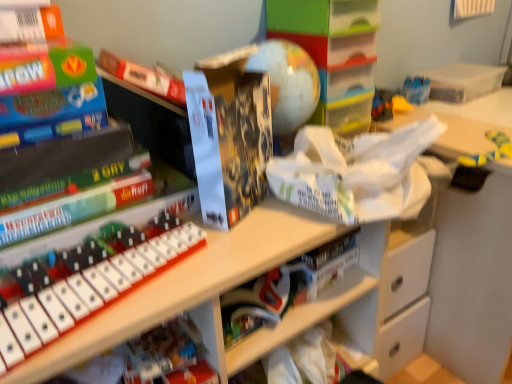
Question: Can you confirm if matte plastic globe at center, positioned as the second shelf in bottom-to-top order, is taller than matte black lego box at center?

Choices:
 (A) yes
 (B) no

Answer: (A)

Question: Would you say matte plastic globe at center, placed as the first shelf when sorted from top to bottom, is outside matte black lego box at center?

Choices:
 (A) yes
 (B) no

Answer: (A)

Question: Can you confirm if matte plastic globe at center, positioned as the second shelf in bottom-to-top order, is positioned to the left of matte black lego box at center?

Choices:
 (A) yes
 (B) no

Answer: (B)

Question: From a real-world perspective, is matte plastic globe at center, placed as the first shelf when sorted from top to bottom, positioned under matte black lego box at center based on gravity?

Choices:
 (A) no
 (B) yes

Answer: (A)

Question: From the image's perspective, is matte plastic globe at center, placed as the first shelf when sorted from top to bottom, above matte black lego box at center?

Choices:
 (A) no
 (B) yes

Answer: (B)

Question: Can you confirm if matte plastic globe at center, placed as the first shelf when sorted from top to bottom, is positioned to the right of matte black lego box at center?

Choices:
 (A) yes
 (B) no

Answer: (A)

Question: Considering the relative sizes of clear plastic box at upper right and matte plastic globe at center, positioned as the second shelf in bottom-to-top order, in the image provided, is clear plastic box at upper right taller than matte plastic globe at center, positioned as the second shelf in bottom-to-top order,?

Choices:
 (A) no
 (B) yes

Answer: (A)

Question: Does clear plastic box at upper right contain matte plastic globe at center, positioned as the second shelf in bottom-to-top order?

Choices:
 (A) yes
 (B) no

Answer: (B)

Question: Would you say clear plastic box at upper right is a long distance from matte plastic globe at center, positioned as the second shelf in bottom-to-top order?

Choices:
 (A) yes
 (B) no

Answer: (B)

Question: Can you confirm if clear plastic box at upper right is positioned to the right of matte plastic globe at center, placed as the first shelf when sorted from top to bottom?

Choices:
 (A) no
 (B) yes

Answer: (B)

Question: From a real-world perspective, is clear plastic box at upper right below matte plastic globe at center, positioned as the second shelf in bottom-to-top order?

Choices:
 (A) yes
 (B) no

Answer: (A)

Question: Can you confirm if clear plastic box at upper right is shorter than matte plastic globe at center, positioned as the second shelf in bottom-to-top order?

Choices:
 (A) yes
 (B) no

Answer: (A)

Question: Is the position of white plastic musical keyboard at center more distant than that of clear plastic box at upper right?

Choices:
 (A) no
 (B) yes

Answer: (A)